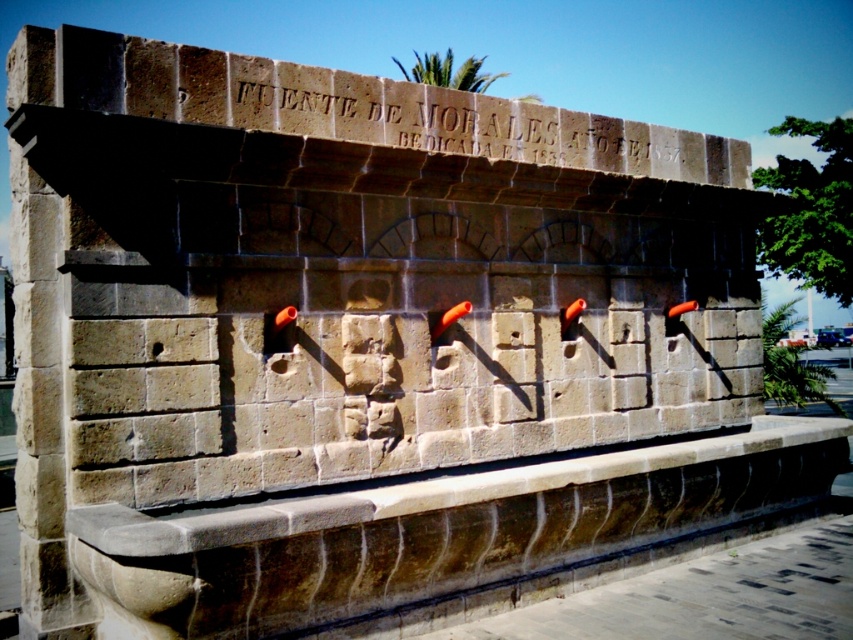
Between smooth stone ledge at center and stone inscription at upper center, which one is positioned higher?

stone inscription at upper center is higher up.

The height and width of the screenshot is (640, 853). Describe the element at coordinates (444, 536) in the screenshot. I see `smooth stone ledge at center` at that location.

Between point (152, 634) and point (601, 129), which one is positioned behind?

The point (601, 129) is behind.

The height and width of the screenshot is (640, 853). In order to click on smooth stone ledge at center in this screenshot , I will do `click(444, 536)`.